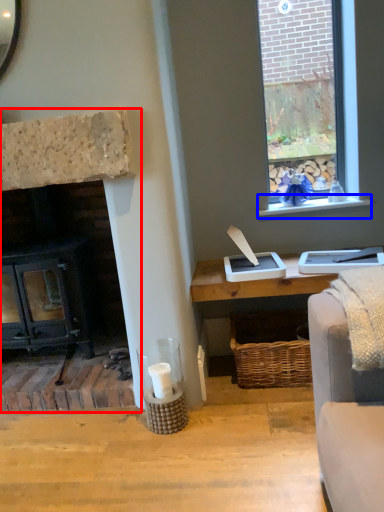
Question: Which object appears closest to the camera in this image, fireplace (highlighted by a red box) or window sill (highlighted by a blue box)?

Choices:
 (A) fireplace
 (B) window sill

Answer: (A)